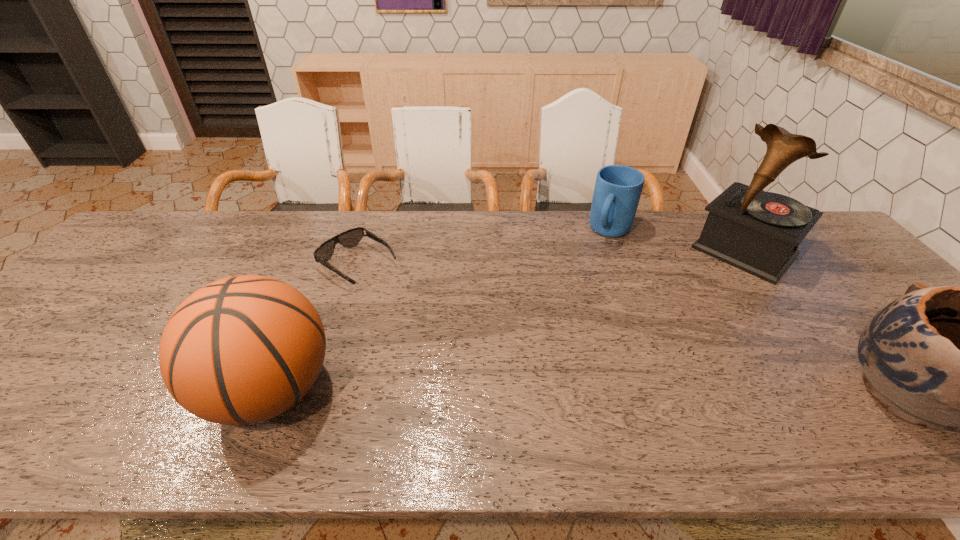
Where is `vacant spot on the desktop that is between the basketball and the third shortest object and is positioned on the side of the mug with the handle`? This screenshot has height=540, width=960. vacant spot on the desktop that is between the basketball and the third shortest object and is positioned on the side of the mug with the handle is located at coordinates (518, 392).

Image resolution: width=960 pixels, height=540 pixels. I want to click on free spot on the desktop that is between the second tallest object and the third shortest object and is positioned on the front-facing side of the shortest object, so click(546, 392).

You are a GUI agent. You are given a task and a screenshot of the screen. Output one action in this format:
    pyautogui.click(x=<x>, y=<y>)
    Task: Click on the vacant spot on the desktop that is between the second tallest object and the pottery and is positioned at the horn opening of the tallest object
    
    Given the screenshot: What is the action you would take?
    pos(613,393)